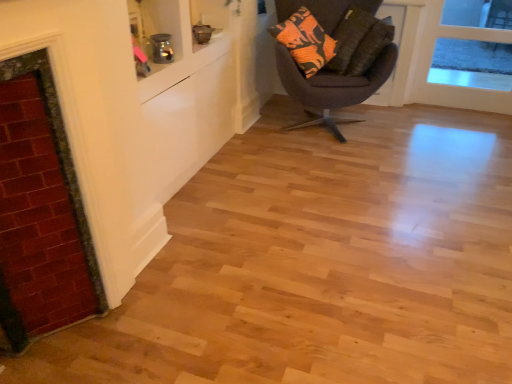
Question: Considering the relative sizes of orange printed fabric pillow at upper right, acting as the second pillow starting from the back, and transparent glass door at upper right in the image provided, is orange printed fabric pillow at upper right, acting as the second pillow starting from the back, bigger than transparent glass door at upper right?

Choices:
 (A) yes
 (B) no

Answer: (B)

Question: Considering the relative sizes of orange printed fabric pillow at upper right, acting as the second pillow starting from the back, and transparent glass door at upper right in the image provided, is orange printed fabric pillow at upper right, acting as the second pillow starting from the back, thinner than transparent glass door at upper right?

Choices:
 (A) yes
 (B) no

Answer: (B)

Question: From a real-world perspective, is orange printed fabric pillow at upper right, marked as the 1th pillow in a front-to-back arrangement, on transparent glass door at upper right?

Choices:
 (A) no
 (B) yes

Answer: (B)

Question: Is orange printed fabric pillow at upper right, acting as the second pillow starting from the back, aimed at transparent glass door at upper right?

Choices:
 (A) yes
 (B) no

Answer: (B)

Question: Is orange printed fabric pillow at upper right, marked as the 1th pillow in a front-to-back arrangement, not within transparent glass door at upper right?

Choices:
 (A) yes
 (B) no

Answer: (A)

Question: Is orange printed fabric pillow at upper right, marked as the 1th pillow in a front-to-back arrangement, at the left side of transparent glass door at upper right?

Choices:
 (A) yes
 (B) no

Answer: (A)

Question: Considering the relative positions of transparent glass door at upper right and orange patterned pillow at upper right, which is counted as the second pillow, starting from the front, in the image provided, is transparent glass door at upper right in front of orange patterned pillow at upper right, which is counted as the second pillow, starting from the front,?

Choices:
 (A) no
 (B) yes

Answer: (A)

Question: From the image's perspective, does transparent glass door at upper right appear lower than orange patterned pillow at upper right, which is counted as the second pillow, starting from the front?

Choices:
 (A) no
 (B) yes

Answer: (B)

Question: Can you confirm if transparent glass door at upper right is wider than orange patterned pillow at upper right, which is counted as the second pillow, starting from the front?

Choices:
 (A) yes
 (B) no

Answer: (B)

Question: Is transparent glass door at upper right outside of orange patterned pillow at upper right, the first pillow when ordered from back to front?

Choices:
 (A) no
 (B) yes

Answer: (B)

Question: Is orange patterned pillow at upper right, the first pillow when ordered from back to front, completely or partially inside transparent glass door at upper right?

Choices:
 (A) yes
 (B) no

Answer: (B)

Question: Could you tell me if transparent glass door at upper right is turned towards orange patterned pillow at upper right, which is counted as the second pillow, starting from the front?

Choices:
 (A) no
 (B) yes

Answer: (A)

Question: From the image's perspective, is orange printed fabric pillow at upper right, acting as the second pillow starting from the back, located beneath red brick fireplace at left?

Choices:
 (A) no
 (B) yes

Answer: (A)